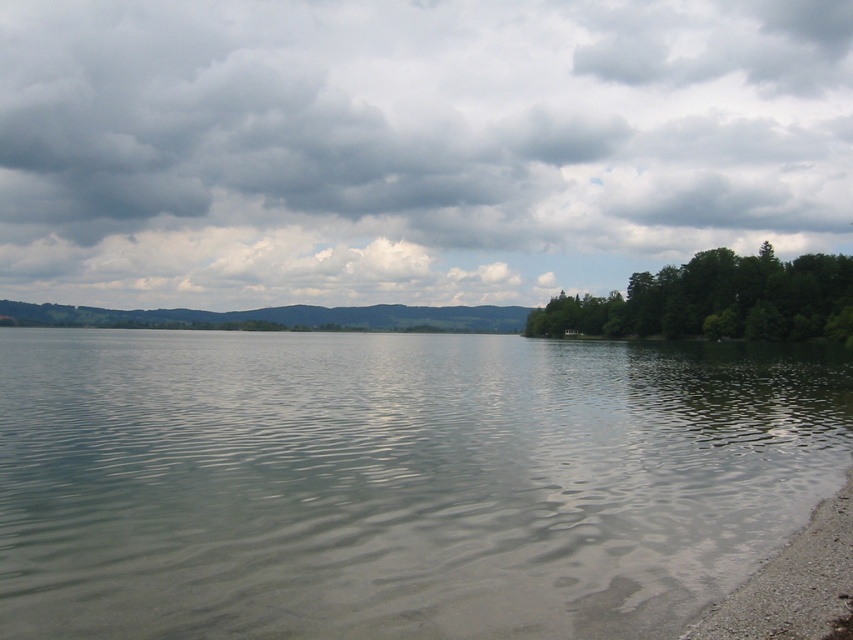
You are standing at the lakeside and see a point marked at coordinates (x=717, y=300). Based on the scene description, what object does this point most likely represent?

The point at (x=717, y=300) corresponds to green leafy trees at right.